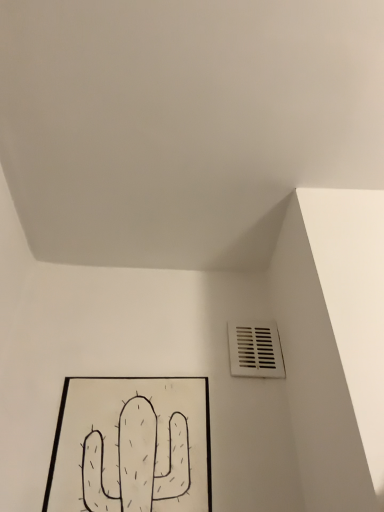
Question: Looking at their shapes, would you say black paper at lower left is wider or thinner than white plastic vent at lower right?

Choices:
 (A) wide
 (B) thin

Answer: (A)

Question: From the image's perspective, is black paper at lower left above or below white plastic vent at lower right?

Choices:
 (A) below
 (B) above

Answer: (A)

Question: Is black paper at lower left in front of or behind white plastic vent at lower right in the image?

Choices:
 (A) front
 (B) behind

Answer: (A)

Question: From the image's perspective, is white plastic vent at lower right located above or below black paper at lower left?

Choices:
 (A) below
 (B) above

Answer: (B)

Question: In terms of width, does white plastic vent at lower right look wider or thinner when compared to black paper at lower left?

Choices:
 (A) thin
 (B) wide

Answer: (A)

Question: Considering their positions, is white plastic vent at lower right located in front of or behind black paper at lower left?

Choices:
 (A) front
 (B) behind

Answer: (B)

Question: Which is correct: white plastic vent at lower right is inside black paper at lower left, or outside of it?

Choices:
 (A) inside
 (B) outside

Answer: (B)